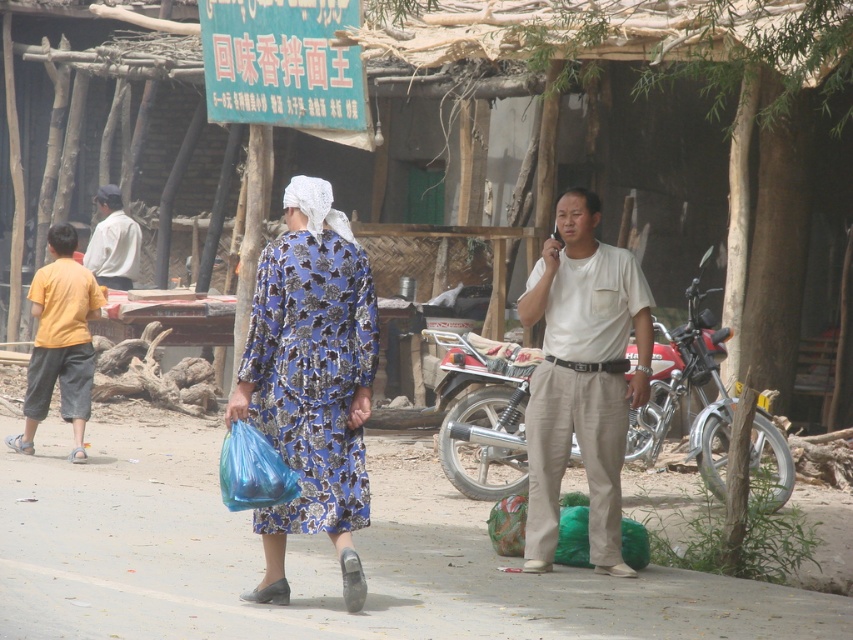
You are standing at the point labeled point (44,330) and want to walk to the point labeled point (515,440). Which direction should you face to move towards your destination?

You should face north because point (515,440) is north of point (44,330).

You are a traveler who just arrived in this village. You see a red matte motorcycle at center and a yellow cotton shirt at left. Which object is closer to your current position?

The yellow cotton shirt at left is closer to you because it is positioned to the left of the red matte motorcycle at center, which is further to the right.

You are a photographer trying to capture a candid shot of the two people in the scene. You want to ensure that both the white cotton shirt at center and the blue floral dress at center are clearly visible in the frame. Based on their positions, which one should you focus on first to ensure both are in focus?

The white cotton shirt at center is positioned on the right side of blue floral dress at center. To ensure both are in focus, you should focus on the blue floral dress at center first since it is closer to the camera, and the white cotton shirt at center will naturally fall into the depth of field if focused on the closer subject.